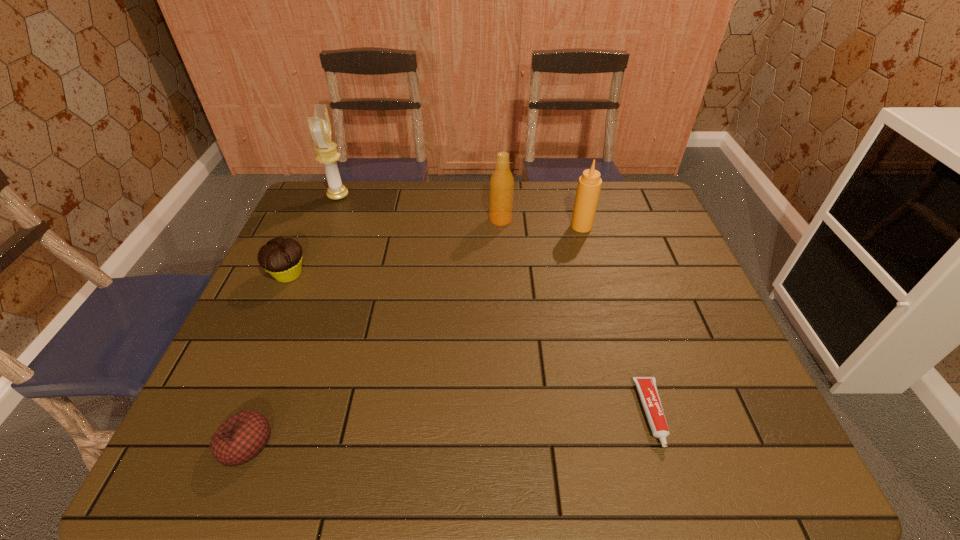
The height and width of the screenshot is (540, 960). Find the location of `vacant region between the condiment and the third object from right to left`. vacant region between the condiment and the third object from right to left is located at coordinates (541, 223).

You are a GUI agent. You are given a task and a screenshot of the screen. Output one action in this format:
    pyautogui.click(x=<x>, y=<y>)
    Task: Click on the vacant region between the fourth object from left to right and the beanbag
    
    Given the screenshot: What is the action you would take?
    pyautogui.click(x=372, y=332)

At what (x,y) coordinates should I click in order to perform the action: click on vacant point located between the condiment and the beanbag. Please return your answer as a coordinate pair (x, y). Looking at the image, I should click on (414, 334).

You are a GUI agent. You are given a task and a screenshot of the screen. Output one action in this format:
    pyautogui.click(x=<x>, y=<y>)
    Task: Click on the free space between the condiment and the toothpaste
    The height and width of the screenshot is (540, 960).
    Given the screenshot: What is the action you would take?
    pyautogui.click(x=616, y=320)

Identify the location of free space between the third object from right to left and the toothpaste. This screenshot has height=540, width=960. (576, 316).

Identify the location of unoccupied position between the third object from right to left and the condiment. This screenshot has width=960, height=540. (541, 223).

You are a GUI agent. You are given a task and a screenshot of the screen. Output one action in this format:
    pyautogui.click(x=<x>, y=<y>)
    Task: Click on the free point between the shortest object and the fourth object from left to right
    This screenshot has height=540, width=960.
    Given the screenshot: What is the action you would take?
    (576, 316)

You are a GUI agent. You are given a task and a screenshot of the screen. Output one action in this format:
    pyautogui.click(x=<x>, y=<y>)
    Task: Click on the vacant area that lies between the beanbag and the farthest object
    
    Given the screenshot: What is the action you would take?
    pyautogui.click(x=292, y=319)

Point out which object is positioned as the third nearest to the shortest object. Please provide its 2D coordinates. Your answer should be formatted as a tuple, i.e. [(x, y)], where the tuple contains the x and y coordinates of a point satisfying the conditions above.

[(241, 437)]

The width and height of the screenshot is (960, 540). What are the coordinates of `object identified as the second closest to the beanbag` in the screenshot? It's located at (647, 389).